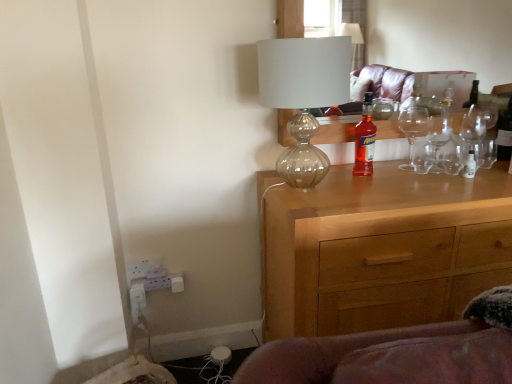
Image resolution: width=512 pixels, height=384 pixels. What do you see at coordinates (303, 96) in the screenshot?
I see `transparent glass lampshade at upper center` at bounding box center [303, 96].

Locate an element on the screen. The width and height of the screenshot is (512, 384). transparent glass lampshade at upper center is located at coordinates (303, 96).

Considering the sizes of objects transparent glass lampshade at upper center and clear glass bottle at upper right, placed as the 2th bottle when sorted from left to right, in the image provided, who is smaller, transparent glass lampshade at upper center or clear glass bottle at upper right, placed as the 2th bottle when sorted from left to right,?

clear glass bottle at upper right, placed as the 2th bottle when sorted from left to right, is smaller.

Could you tell me if transparent glass lampshade at upper center is facing clear glass bottle at upper right, placed as the first bottle when sorted from back to front?

No, transparent glass lampshade at upper center does not turn towards clear glass bottle at upper right, placed as the first bottle when sorted from back to front.

From the image's perspective, is transparent glass lampshade at upper center positioned above or below clear glass bottle at upper right, placed as the first bottle when sorted from back to front?

From the image's perspective, transparent glass lampshade at upper center appears below clear glass bottle at upper right, placed as the first bottle when sorted from back to front.

Looking at this image, from a real-world perspective, is wooden chest of drawers at center positioned over translucent glass bottle at center, the 2th bottle positioned from the back, based on gravity?

No, from a real-world perspective, wooden chest of drawers at center is not on top of translucent glass bottle at center, the 2th bottle positioned from the back.

Is the surface of wooden chest of drawers at center in direct contact with translucent glass bottle at center, the 2th bottle positioned from the back?

No, wooden chest of drawers at center is not making contact with translucent glass bottle at center, the 2th bottle positioned from the back.

Choose the correct answer: Is wooden chest of drawers at center inside translucent glass bottle at center, marked as the 1th bottle in a left-to-right arrangement, or outside it?

The correct answer is: outside.

Based on the photo, considering the sizes of objects translucent glass bottle at center, which is the first bottle from front to back, and transparent glass lampshade at upper center in the image provided, who is bigger, translucent glass bottle at center, which is the first bottle from front to back, or transparent glass lampshade at upper center?

Bigger between the two is transparent glass lampshade at upper center.

Is translucent glass bottle at center, the 2th bottle positioned from the back, shorter than transparent glass lampshade at upper center?

Yes.

Is translucent glass bottle at center, marked as the 1th bottle in a left-to-right arrangement, situated inside transparent glass lampshade at upper center or outside?

translucent glass bottle at center, marked as the 1th bottle in a left-to-right arrangement, is not inside transparent glass lampshade at upper center, it's outside.

Consider the image. Looking at their sizes, would you say translucent glass bottle at center, which is the first bottle from front to back, is wider or thinner than transparent glass lampshade at upper center?

Considering their sizes, translucent glass bottle at center, which is the first bottle from front to back, looks slimmer than transparent glass lampshade at upper center.

Which object is thinner, transparent glass lampshade at upper center or wooden chest of drawers at center?

With smaller width is transparent glass lampshade at upper center.

From a real-world perspective, is transparent glass lampshade at upper center physically located above or below wooden chest of drawers at center?

transparent glass lampshade at upper center is above wooden chest of drawers at center.

Would you consider transparent glass lampshade at upper center to be distant from wooden chest of drawers at center?

No, transparent glass lampshade at upper center is not far away from wooden chest of drawers at center.

Would you say transparent glass lampshade at upper center is outside wooden chest of drawers at center?

Indeed, transparent glass lampshade at upper center is completely outside wooden chest of drawers at center.

Does point (507, 146) come closer to viewer compared to point (370, 110)?

No, it is not.

Can you confirm if clear glass bottle at upper right, placed as the 2th bottle when sorted from left to right, is positioned to the right of translucent glass bottle at center, which is the first bottle from front to back?

Correct, you'll find clear glass bottle at upper right, placed as the 2th bottle when sorted from left to right, to the right of translucent glass bottle at center, which is the first bottle from front to back.

Between clear glass bottle at upper right, the first bottle viewed from the right, and translucent glass bottle at center, marked as the 1th bottle in a left-to-right arrangement, which one is positioned in front?

translucent glass bottle at center, marked as the 1th bottle in a left-to-right arrangement, is closer to the camera.

From the image's perspective, which one is positioned lower, clear glass bottle at upper right, placed as the first bottle when sorted from back to front, or translucent glass bottle at center, placed as the 2th bottle when sorted from right to left?

translucent glass bottle at center, placed as the 2th bottle when sorted from right to left, from the image's perspective.

In the scene shown: Looking at their sizes, would you say wooden chest of drawers at center is wider or thinner than clear glass bottle at upper right, placed as the first bottle when sorted from back to front?

wooden chest of drawers at center is wider than clear glass bottle at upper right, placed as the first bottle when sorted from back to front.

Is wooden chest of drawers at center facing away from clear glass bottle at upper right, placed as the first bottle when sorted from back to front?

No, wooden chest of drawers at center's orientation is not away from clear glass bottle at upper right, placed as the first bottle when sorted from back to front.

Between wooden chest of drawers at center and clear glass bottle at upper right, the first bottle viewed from the right, which one has more height?

wooden chest of drawers at center is taller.

Does wooden chest of drawers at center appear on the left side of clear glass bottle at upper right, placed as the 2th bottle when sorted from left to right?

Indeed, wooden chest of drawers at center is positioned on the left side of clear glass bottle at upper right, placed as the 2th bottle when sorted from left to right.

Is clear glass bottle at upper right, the first bottle viewed from the right, spatially inside transparent glass lampshade at upper center, or outside of it?

clear glass bottle at upper right, the first bottle viewed from the right, lies outside transparent glass lampshade at upper center.

Considering the positions of objects clear glass bottle at upper right, placed as the first bottle when sorted from back to front, and transparent glass lampshade at upper center in the image provided, who is in front, clear glass bottle at upper right, placed as the first bottle when sorted from back to front, or transparent glass lampshade at upper center?

transparent glass lampshade at upper center is in front.

Looking at this image, is clear glass bottle at upper right, placed as the 2th bottle when sorted from left to right, directly adjacent to transparent glass lampshade at upper center?

clear glass bottle at upper right, placed as the 2th bottle when sorted from left to right, and transparent glass lampshade at upper center are not in contact.

Where is `lamp in front of the clear glass bottle at upper right, placed as the 2th bottle when sorted from left to right`? lamp in front of the clear glass bottle at upper right, placed as the 2th bottle when sorted from left to right is located at coordinates (303, 96).

This screenshot has width=512, height=384. I want to click on the 2nd bottle behind when counting from the transparent glass lampshade at upper center, so click(x=505, y=133).

At what (x,y) coordinates should I click in order to perform the action: click on bottle lying on the left of wooden chest of drawers at center. Please return your answer as a coordinate pair (x, y). Looking at the image, I should click on (365, 140).

From the picture: Considering their positions, is wooden chest of drawers at center positioned further to translucent glass bottle at center, the 2th bottle positioned from the back, than transparent glass lampshade at upper center?

wooden chest of drawers at center is positioned further to the anchor translucent glass bottle at center, the 2th bottle positioned from the back.

Estimate the real-world distances between objects in this image. Which object is further from wooden chest of drawers at center, clear glass bottle at upper right, placed as the 2th bottle when sorted from left to right, or translucent glass bottle at center, marked as the 1th bottle in a left-to-right arrangement?

Among the two, clear glass bottle at upper right, placed as the 2th bottle when sorted from left to right, is located further to wooden chest of drawers at center.

Based on their spatial positions, is clear glass bottle at upper right, which is the second bottle from front to back, or translucent glass bottle at center, which is the first bottle from front to back, closer to transparent glass lampshade at upper center?

The object closer to transparent glass lampshade at upper center is translucent glass bottle at center, which is the first bottle from front to back.

Considering their positions, is clear glass bottle at upper right, placed as the 2th bottle when sorted from left to right, positioned closer to translucent glass bottle at center, which is the first bottle from front to back, than transparent glass lampshade at upper center?

transparent glass lampshade at upper center is closer to translucent glass bottle at center, which is the first bottle from front to back.

Which object lies further to the anchor point wooden chest of drawers at center, clear glass bottle at upper right, which is the second bottle from front to back, or transparent glass lampshade at upper center?

clear glass bottle at upper right, which is the second bottle from front to back, is positioned further to the anchor wooden chest of drawers at center.

Consider the image. Based on their spatial positions, is transparent glass lampshade at upper center or clear glass bottle at upper right, the first bottle viewed from the right, further from translucent glass bottle at center, placed as the 2th bottle when sorted from right to left?

clear glass bottle at upper right, the first bottle viewed from the right, is further to translucent glass bottle at center, placed as the 2th bottle when sorted from right to left.

Based on their spatial positions, is translucent glass bottle at center, marked as the 1th bottle in a left-to-right arrangement, or transparent glass lampshade at upper center further from wooden chest of drawers at center?

transparent glass lampshade at upper center is further to wooden chest of drawers at center.

Looking at the image, which one is located further to transparent glass lampshade at upper center, translucent glass bottle at center, which is the first bottle from front to back, or wooden chest of drawers at center?

wooden chest of drawers at center is positioned further to the anchor transparent glass lampshade at upper center.

At what (x,y) coordinates should I click in order to perform the action: click on bottle situated between transparent glass lampshade at upper center and clear glass bottle at upper right, which is the second bottle from front to back, from left to right. Please return your answer as a coordinate pair (x, y). This screenshot has width=512, height=384. Looking at the image, I should click on (365, 140).

Where is `chest of drawers between transparent glass lampshade at upper center and clear glass bottle at upper right, the first bottle viewed from the right, in the horizontal direction`? Image resolution: width=512 pixels, height=384 pixels. chest of drawers between transparent glass lampshade at upper center and clear glass bottle at upper right, the first bottle viewed from the right, in the horizontal direction is located at coordinates (381, 249).

Identify the location of bottle between transparent glass lampshade at upper center and wooden chest of drawers at center from top to bottom. The height and width of the screenshot is (384, 512). (365, 140).

You are a GUI agent. You are given a task and a screenshot of the screen. Output one action in this format:
    pyautogui.click(x=<x>, y=<y>)
    Task: Click on the bottle between clear glass bottle at upper right, placed as the 2th bottle when sorted from left to right, and wooden chest of drawers at center vertically
    The image size is (512, 384).
    Given the screenshot: What is the action you would take?
    pyautogui.click(x=365, y=140)